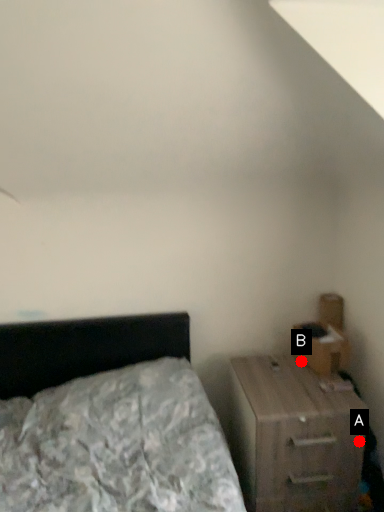
Question: Two points are circled on the image, labeled by A and B beside each circle. Among these points, which one is nearest to the camera?

Choices:
 (A) A is closer
 (B) B is closer

Answer: (A)